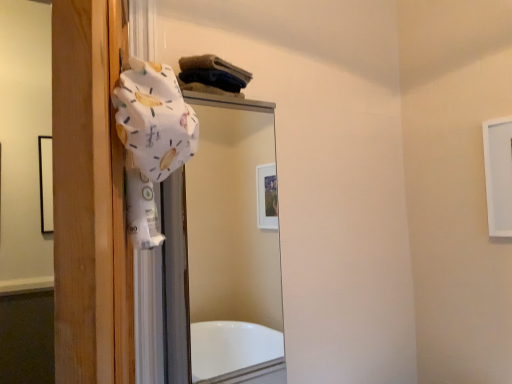
Describe the element at coordinates (234, 246) in the screenshot. I see `clear glass mirror at upper center` at that location.

Where is `clear glass mirror at upper center`? The image size is (512, 384). clear glass mirror at upper center is located at coordinates (234, 246).

This screenshot has width=512, height=384. Identify the location of clear glass mirror at upper center. (234, 246).